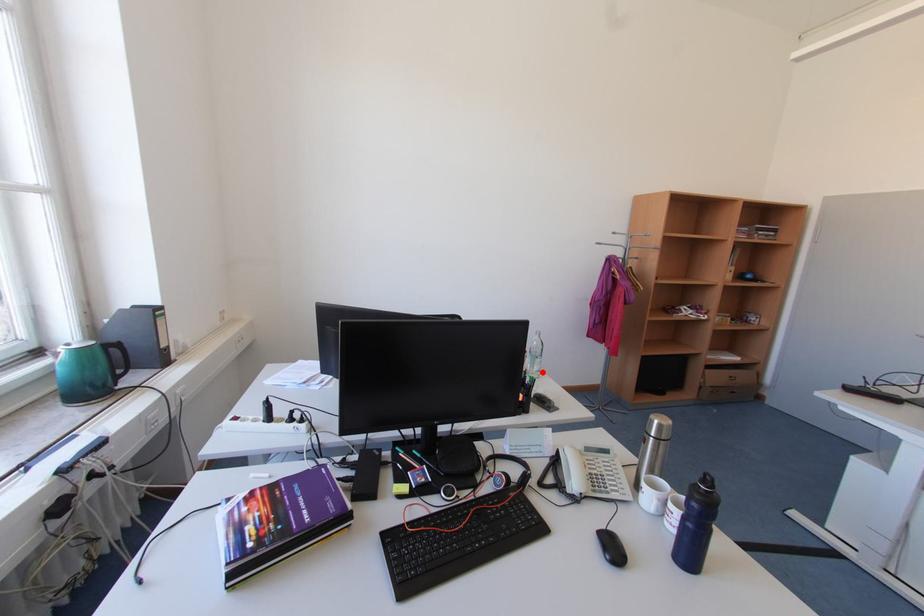
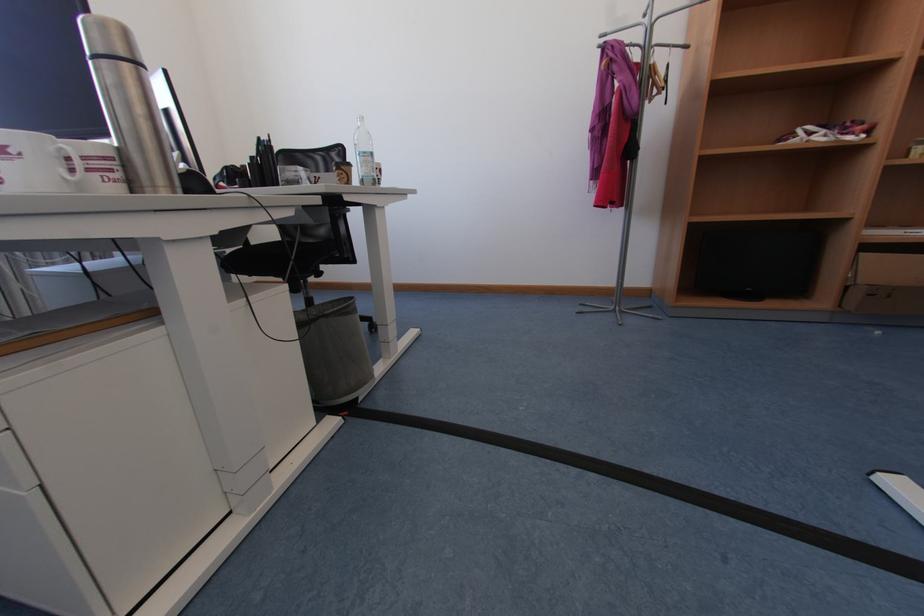
Question: I am providing you with two images of the same scene from different viewpoints. Image1 has a red point marked. In image2, the corresponding 3D location appears at what relative position? Reply with the corresponding letter.

Choices:
 (A) Closer
 (B) Farther

Answer: (A)